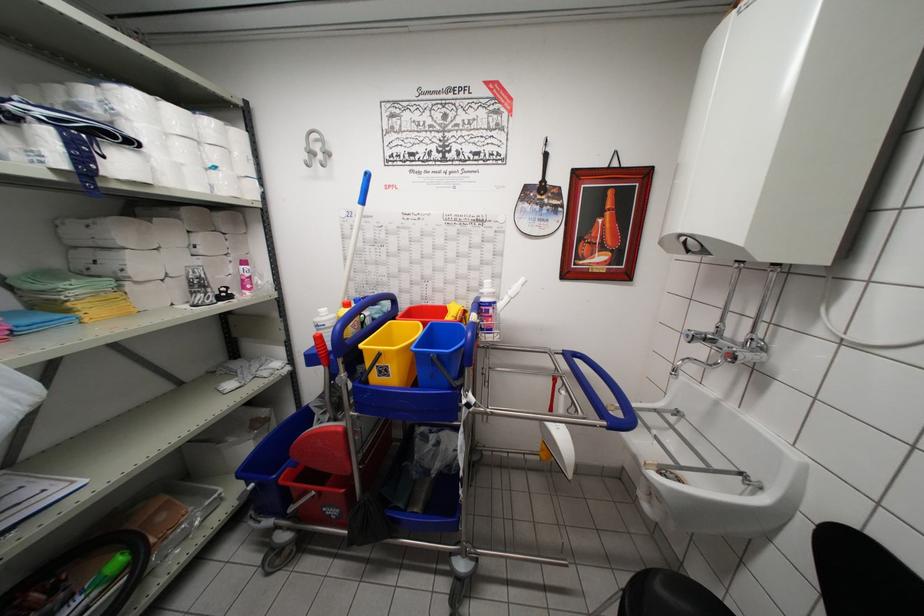
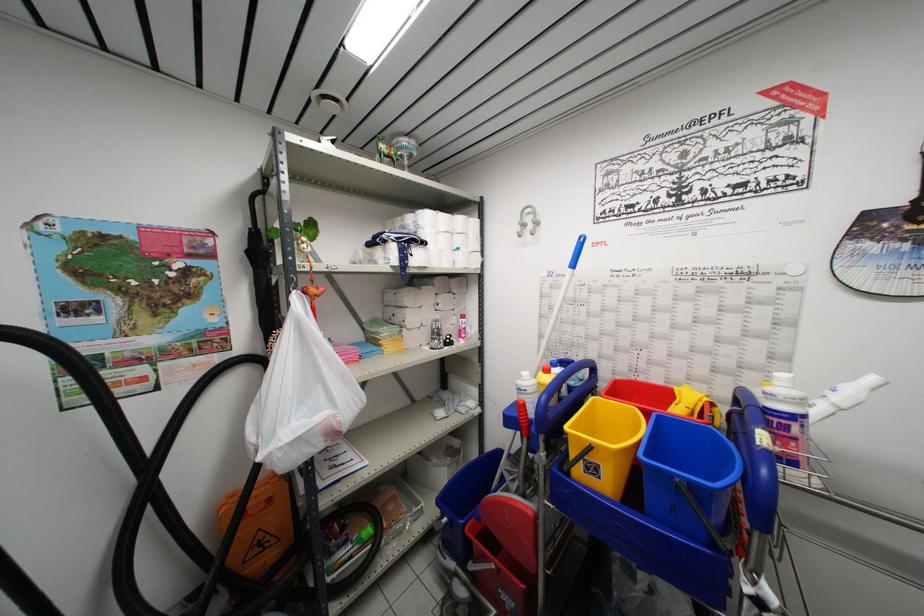
Locate, in the second image, the point that corresponds to (x=162, y=105) in the first image.

(441, 217)